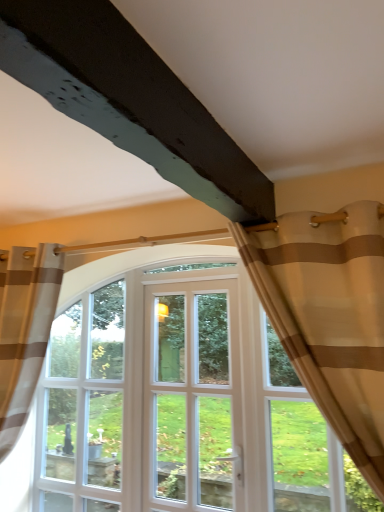
The image size is (384, 512). Describe the element at coordinates (25, 331) in the screenshot. I see `brown striped curtain at left, marked as the 1th curtain in a back-to-front arrangement` at that location.

The height and width of the screenshot is (512, 384). Find the location of `white glass door at center`. white glass door at center is located at coordinates (191, 396).

Measure the distance between beige striped curtain at upper right, the second curtain viewed from the left, and camera.

4.58 feet.

Where is `brown striped curtain at left, marked as the 1th curtain in a back-to-front arrangement`? This screenshot has height=512, width=384. brown striped curtain at left, marked as the 1th curtain in a back-to-front arrangement is located at coordinates (25, 331).

Does brown striped curtain at left, positioned as the 2th curtain in right-to-left order, have a smaller size compared to beige striped curtain at upper right, which is the second curtain in back-to-front order?

No, brown striped curtain at left, positioned as the 2th curtain in right-to-left order, is not smaller than beige striped curtain at upper right, which is the second curtain in back-to-front order.

Considering the sizes of objects brown striped curtain at left, positioned as the 2th curtain in right-to-left order, and beige striped curtain at upper right, which is the second curtain in back-to-front order, in the image provided, who is thinner, brown striped curtain at left, positioned as the 2th curtain in right-to-left order, or beige striped curtain at upper right, which is the second curtain in back-to-front order,?

Thinner between the two is beige striped curtain at upper right, which is the second curtain in back-to-front order.

How far apart are brown striped curtain at left, positioned as the 2th curtain in right-to-left order, and beige striped curtain at upper right, which is the first curtain from front to back?

brown striped curtain at left, positioned as the 2th curtain in right-to-left order, and beige striped curtain at upper right, which is the first curtain from front to back, are 4.79 feet apart from each other.

Considering the positions of point (9, 389) and point (339, 319), is point (9, 389) closer or farther from the camera than point (339, 319)?

Point (9, 389) appears to be farther away from the viewer than point (339, 319).

Can brown striped curtain at left, acting as the first curtain starting from the left, be found inside beige striped curtain at upper right, which is the first curtain from front to back?

No, brown striped curtain at left, acting as the first curtain starting from the left, is located outside of beige striped curtain at upper right, which is the first curtain from front to back.

From a real-world perspective, between beige striped curtain at upper right, which is the second curtain in back-to-front order, and brown striped curtain at left, positioned as the 2th curtain in front-to-back order, who is vertically lower?

In real-world perspective, brown striped curtain at left, positioned as the 2th curtain in front-to-back order, is lower.

Does beige striped curtain at upper right, the second curtain viewed from the left, have a larger size compared to brown striped curtain at left, marked as the 1th curtain in a back-to-front arrangement?

No, beige striped curtain at upper right, the second curtain viewed from the left, is not bigger than brown striped curtain at left, marked as the 1th curtain in a back-to-front arrangement.

Could you tell me if beige striped curtain at upper right, which is the first curtain from front to back, is facing brown striped curtain at left, acting as the first curtain starting from the left?

No, beige striped curtain at upper right, which is the first curtain from front to back, does not turn towards brown striped curtain at left, acting as the first curtain starting from the left.

Considering the positions of point (187, 448) and point (27, 347), is point (187, 448) closer or farther from the camera than point (27, 347)?

Clearly, point (187, 448) is more distant from the camera than point (27, 347).

Can you confirm if white glass door at center is shorter than brown striped curtain at left, positioned as the 2th curtain in front-to-back order?

Indeed, white glass door at center has a lesser height compared to brown striped curtain at left, positioned as the 2th curtain in front-to-back order.

How different are the orientations of white glass door at center and brown striped curtain at left, marked as the 1th curtain in a back-to-front arrangement, in degrees?

0.569 degrees separate the facing orientations of white glass door at center and brown striped curtain at left, marked as the 1th curtain in a back-to-front arrangement.

From a real-world perspective, is white glass door at center physically above brown striped curtain at left, positioned as the 2th curtain in front-to-back order?

Actually, white glass door at center is physically below brown striped curtain at left, positioned as the 2th curtain in front-to-back order, in the real world.

Can you tell me how much white glass door at center and beige striped curtain at upper right, which is the first curtain from right to left, differ in facing direction?

The facing directions of white glass door at center and beige striped curtain at upper right, which is the first curtain from right to left, are 0.569 degrees apart.

Considering the relative sizes of white glass door at center and beige striped curtain at upper right, which is the first curtain from front to back, in the image provided, is white glass door at center bigger than beige striped curtain at upper right, which is the first curtain from front to back,?

No.

Does white glass door at center touch beige striped curtain at upper right, which is the first curtain from right to left?

No.

Does white glass door at center have a lesser height compared to beige striped curtain at upper right, the second curtain viewed from the left?

No, white glass door at center is not shorter than beige striped curtain at upper right, the second curtain viewed from the left.

Between brown striped curtain at left, positioned as the 2th curtain in front-to-back order, and white glass door at center, which one appears on the left side from the viewer's perspective?

brown striped curtain at left, positioned as the 2th curtain in front-to-back order, is more to the left.

In the image, is brown striped curtain at left, marked as the 1th curtain in a back-to-front arrangement, positioned in front of or behind white glass door at center?

brown striped curtain at left, marked as the 1th curtain in a back-to-front arrangement, is positioned closer to the viewer than white glass door at center.

Between point (38, 324) and point (196, 425), which one is positioned behind?

The point (196, 425) is more distant.

Can white glass door at center be found inside brown striped curtain at left, marked as the 1th curtain in a back-to-front arrangement?

No, white glass door at center is not a part of brown striped curtain at left, marked as the 1th curtain in a back-to-front arrangement.

I want to click on the 2nd curtain directly above the white glass door at center (from a real-world perspective), so click(330, 316).

Is point (267, 301) more distant than point (152, 348)?

That is False.

Is beige striped curtain at upper right, the second curtain viewed from the left, not near white glass door at center?

No, there isn't a large distance between beige striped curtain at upper right, the second curtain viewed from the left, and white glass door at center.

How many degrees apart are the facing directions of beige striped curtain at upper right, the second curtain viewed from the left, and white glass door at center?

They differ by 0.569 degrees in their facing directions.

Image resolution: width=384 pixels, height=512 pixels. I want to click on curtain that appears above the brown striped curtain at left, marked as the 1th curtain in a back-to-front arrangement (from a real-world perspective), so click(x=330, y=316).

The image size is (384, 512). In order to click on curtain that appears below the beige striped curtain at upper right, which is the second curtain in back-to-front order (from the image's perspective) in this screenshot , I will do `click(25, 331)`.

Based on their spatial positions, is beige striped curtain at upper right, the second curtain viewed from the left, or white glass door at center further from brown striped curtain at left, positioned as the 2th curtain in front-to-back order?

Based on the image, beige striped curtain at upper right, the second curtain viewed from the left, appears to be further to brown striped curtain at left, positioned as the 2th curtain in front-to-back order.

Looking at the image, which one is located further to beige striped curtain at upper right, the second curtain viewed from the left, brown striped curtain at left, marked as the 1th curtain in a back-to-front arrangement, or white glass door at center?

brown striped curtain at left, marked as the 1th curtain in a back-to-front arrangement.

Looking at the image, which one is located closer to brown striped curtain at left, acting as the first curtain starting from the left, white glass door at center or beige striped curtain at upper right, which is the first curtain from front to back?

white glass door at center is closer to brown striped curtain at left, acting as the first curtain starting from the left.

Considering their positions, is white glass door at center positioned closer to beige striped curtain at upper right, which is the first curtain from right to left, than brown striped curtain at left, positioned as the 2th curtain in right-to-left order?

Among the two, white glass door at center is located nearer to beige striped curtain at upper right, which is the first curtain from right to left.

Estimate the real-world distances between objects in this image. Which object is further from white glass door at center, brown striped curtain at left, positioned as the 2th curtain in front-to-back order, or beige striped curtain at upper right, which is the first curtain from right to left?

The object further to white glass door at center is beige striped curtain at upper right, which is the first curtain from right to left.

When comparing their distances from white glass door at center, does beige striped curtain at upper right, the second curtain viewed from the left, or brown striped curtain at left, positioned as the 2th curtain in front-to-back order, seem closer?

brown striped curtain at left, positioned as the 2th curtain in front-to-back order, lies closer to white glass door at center than the other object.

Identify the location of screen door between brown striped curtain at left, acting as the first curtain starting from the left, and beige striped curtain at upper right, the second curtain viewed from the left, from left to right. (191, 396).